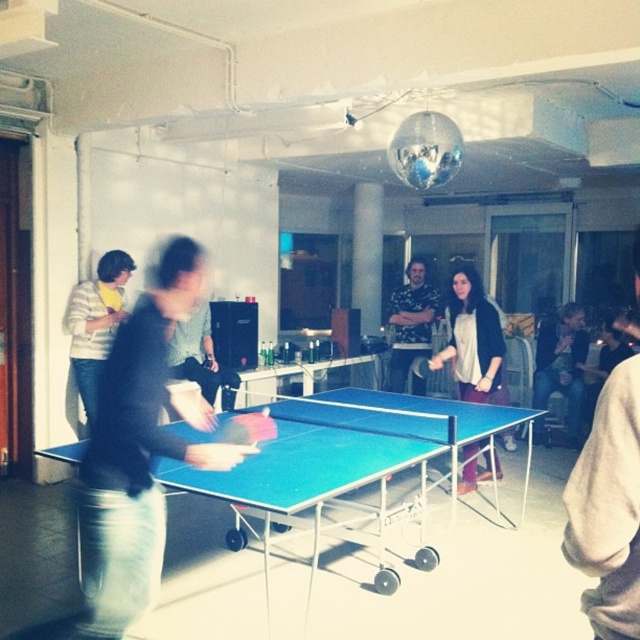
Can you confirm if light brown sweater at right is positioned to the left of striped sweater at left?

In fact, light brown sweater at right is to the right of striped sweater at left.

Measure the distance between point (630, 374) and camera.

Point (630, 374) and camera are 1.29 meters apart.

The width and height of the screenshot is (640, 640). Identify the location of light brown sweater at right. (609, 508).

Can you confirm if blue plastic table at center is shorter than matte black shirt at center?

Yes.

Does blue plastic table at center come behind matte black shirt at center?

Yes, it is behind matte black shirt at center.

Does point (388, 448) come farther from viewer compared to point (132, 321)?

That is True.

At what (x,y) coordinates should I click in order to perform the action: click on blue plastic table at center. Please return your answer as a coordinate pair (x, y). Looking at the image, I should click on (346, 464).

Which is below, striped sweater at left or dark brown leather jacket at center?

dark brown leather jacket at center is lower down.

Who is positioned more to the left, striped sweater at left or dark brown leather jacket at center?

From the viewer's perspective, striped sweater at left appears more on the left side.

Which is behind, point (106, 321) or point (566, 406)?

Positioned behind is point (566, 406).

Locate an element on the screen. The image size is (640, 640). striped sweater at left is located at coordinates (96, 323).